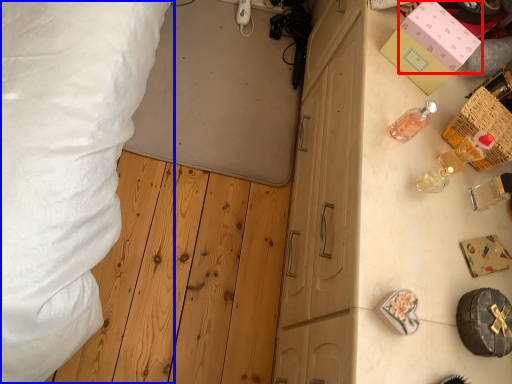
Question: Which point is further to the camera, box (highlighted by a red box) or bed (highlighted by a blue box)?

Choices:
 (A) box
 (B) bed

Answer: (B)